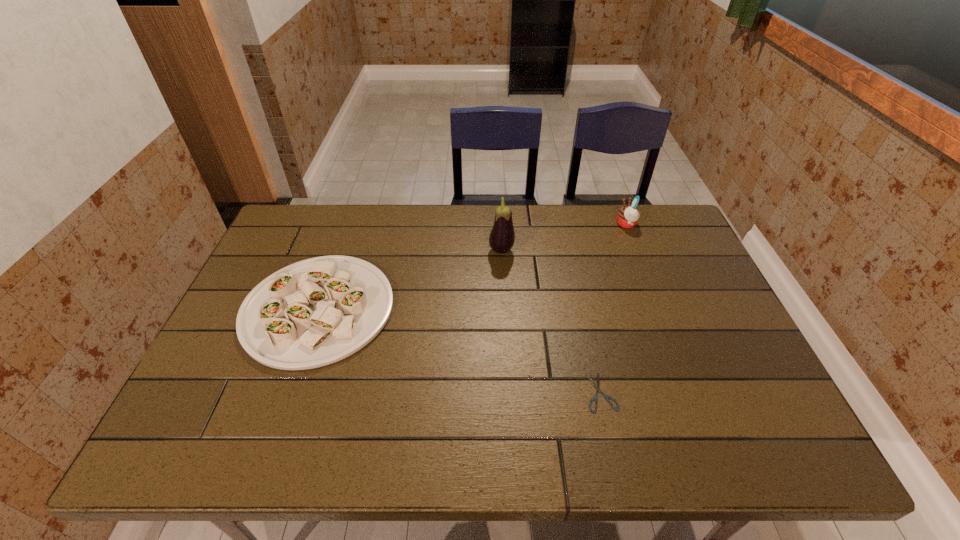
You are a GUI agent. You are given a task and a screenshot of the screen. Output one action in this format:
    pyautogui.click(x=<x>, y=<y>)
    Task: Click on the free space located 0.340m on the front-facing side of the third shortest object
    This screenshot has height=540, width=960.
    Given the screenshot: What is the action you would take?
    pyautogui.click(x=516, y=224)

Where is `free space located 0.060m on the front-facing side of the third shortest object`? The width and height of the screenshot is (960, 540). free space located 0.060m on the front-facing side of the third shortest object is located at coordinates (598, 224).

Where is `blank space located 0.090m on the right of the platter`? This screenshot has width=960, height=540. blank space located 0.090m on the right of the platter is located at coordinates (425, 309).

Locate an element on the screen. The image size is (960, 540). vacant space located 0.360m on the left of the nearest object is located at coordinates (432, 392).

At what (x,y) coordinates should I click in order to perform the action: click on eggplant present at the far edge. Please return your answer as a coordinate pair (x, y). Image resolution: width=960 pixels, height=540 pixels. Looking at the image, I should click on (502, 237).

Where is `muffin that is at the far edge`? Image resolution: width=960 pixels, height=540 pixels. muffin that is at the far edge is located at coordinates point(627,217).

This screenshot has height=540, width=960. What are the coordinates of `object positioned at the left edge` in the screenshot? It's located at (315, 312).

Locate an element on the screen. Image resolution: width=960 pixels, height=540 pixels. object situated at the right edge is located at coordinates (627, 217).

You are a GUI agent. You are given a task and a screenshot of the screen. Output one action in this format:
    pyautogui.click(x=<x>, y=<y>)
    Task: Click on the object that is at the far right corner
    
    Given the screenshot: What is the action you would take?
    pyautogui.click(x=627, y=217)

The image size is (960, 540). I want to click on free spot at the far edge of the desktop, so click(x=351, y=213).